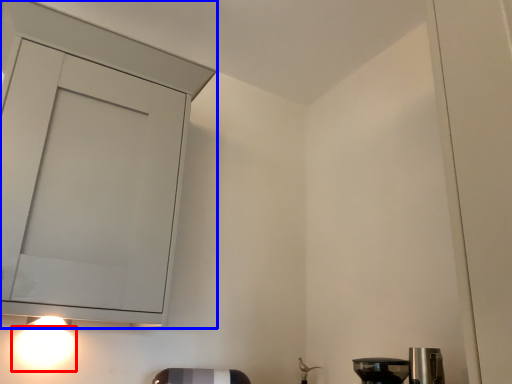
Question: Which of the following is the closest to the observer, light (highlighted by a red box) or cabinetry (highlighted by a blue box)?

Choices:
 (A) light
 (B) cabinetry

Answer: (B)